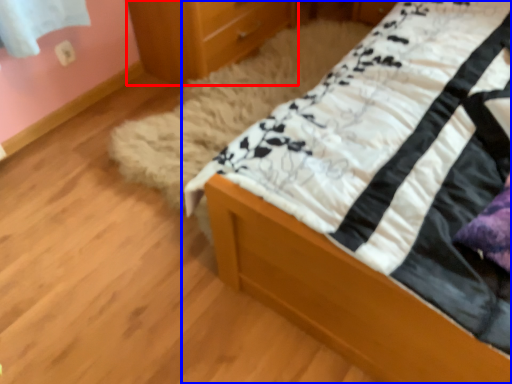
Question: Which object appears farthest to the camera in this image, chest of drawers (highlighted by a red box) or bed (highlighted by a blue box)?

Choices:
 (A) chest of drawers
 (B) bed

Answer: (A)